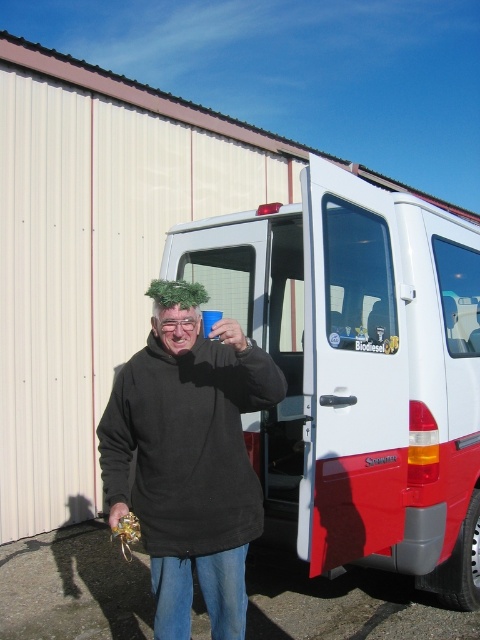
You are a delivery driver who needs to park the white matte van at center and the black fleece at center in a narrow alley. Based on the scene, can you determine which vehicle is wider?

The white matte van at center might be wider than black fleece at center, so it may not fit in the narrow alley if the black fleece at center can.